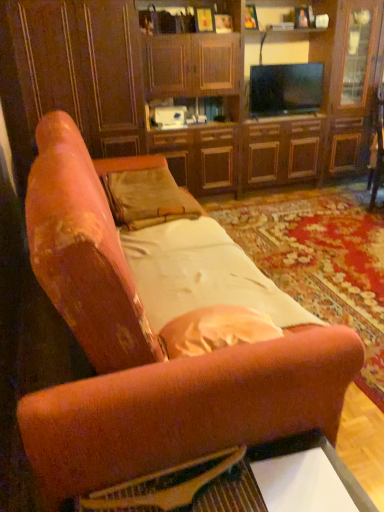
Question: From a real-world perspective, is velvet orange couch at center above or below wooden glossy table at lower center?

Choices:
 (A) below
 (B) above

Answer: (B)

Question: Does point [81, 431] appear closer or farther from the camera than point [311, 488]?

Choices:
 (A) farther
 (B) closer

Answer: (B)

Question: Based on their relative distances, which object is nearer to the suede-like beige pillow at center?

Choices:
 (A) wooden guitar at lower center
 (B) wooden glossy table at lower center
 (C) velvet orange couch at center
 (D) white satin sheet at center
 (E) wooden cabinet at center

Answer: (D)

Question: Which of these objects is positioned closest to the wooden cabinet at center?

Choices:
 (A) velvet orange couch at center
 (B) wooden glossy table at lower center
 (C) wooden guitar at lower center
 (D) white satin sheet at center
 (E) suede-like beige pillow at center

Answer: (E)